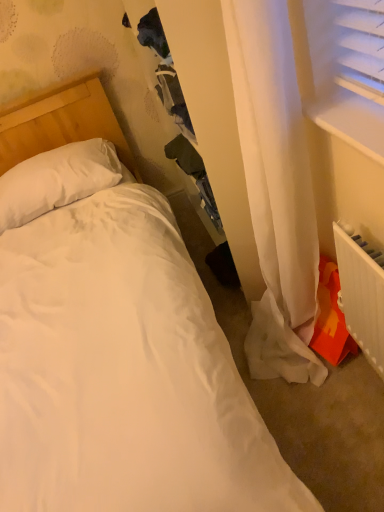
Question: Should I look upward or downward to see white plastic radiator at lower right?

Choices:
 (A) up
 (B) down

Answer: (B)

Question: Does white plastic radiator at lower right come behind white plastic window sill at upper right?

Choices:
 (A) yes
 (B) no

Answer: (A)

Question: Is white plastic radiator at lower right oriented towards white plastic window sill at upper right?

Choices:
 (A) yes
 (B) no

Answer: (B)

Question: From the image's perspective, is white plastic radiator at lower right located above white plastic window sill at upper right?

Choices:
 (A) yes
 (B) no

Answer: (B)

Question: Is white plastic radiator at lower right positioned in front of white plastic window sill at upper right?

Choices:
 (A) no
 (B) yes

Answer: (A)

Question: From a real-world perspective, does white plastic radiator at lower right sit lower than white plastic window sill at upper right?

Choices:
 (A) no
 (B) yes

Answer: (B)

Question: Is white plastic radiator at lower right shorter than white plastic window sill at upper right?

Choices:
 (A) no
 (B) yes

Answer: (A)

Question: Is white soft pillow at upper left oriented towards white plastic radiator at lower right?

Choices:
 (A) no
 (B) yes

Answer: (B)

Question: From a real-world perspective, is white soft pillow at upper left under white plastic radiator at lower right?

Choices:
 (A) yes
 (B) no

Answer: (B)

Question: Is white soft pillow at upper left far from white plastic radiator at lower right?

Choices:
 (A) no
 (B) yes

Answer: (B)

Question: Is white soft pillow at upper left to the right of white plastic radiator at lower right from the viewer's perspective?

Choices:
 (A) yes
 (B) no

Answer: (B)

Question: Considering the relative sizes of white soft pillow at upper left and white plastic radiator at lower right in the image provided, is white soft pillow at upper left smaller than white plastic radiator at lower right?

Choices:
 (A) yes
 (B) no

Answer: (B)

Question: Does white soft pillow at upper left have a lesser height compared to white plastic radiator at lower right?

Choices:
 (A) no
 (B) yes

Answer: (B)

Question: From the image's perspective, would you say white soft pillow at upper left is shown under white plastic window sill at upper right?

Choices:
 (A) no
 (B) yes

Answer: (A)